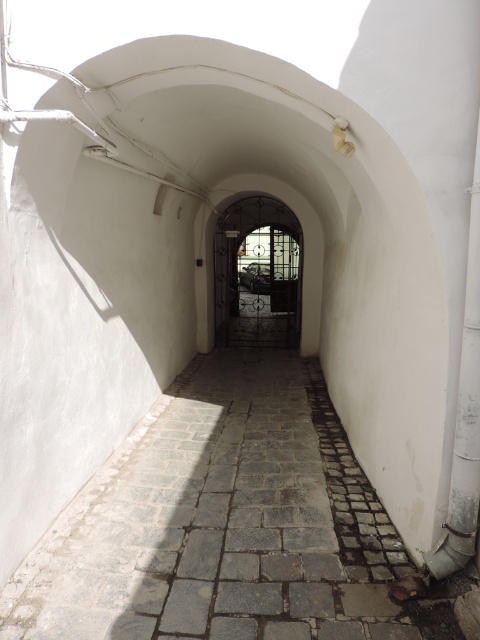
Based on the photo, you are a delivery person carrying a large package that is 2 meters wide. You need to navigate through the narrow arched passageway shown in the image. Can you pass through the space between the gray stone path at center and the dark wrought iron gate at center without tilting the package?

The gray stone path at center and dark wrought iron gate at center are 7.52 meters apart from each other. Since the package is only 2 meters wide, there is sufficient space between them to pass through without tilting the package.

You are a delivery person trying to push a large cart through the narrow arched passageway. The cart is as wide as the gray stone path at center. Can you pass through the dark wrought iron gate at center without any adjustments?

The gray stone path at center is bigger than the dark wrought iron gate at center. Since the cart is as wide as the path, it will not fit through the gate, which is narrower. Adjustments are needed to make the cart narrower or find an alternative route.

You are navigating through the arched passageway and need to determine the proximity of two points. Which point, point (136, 589) or point (285, 296), is nearer to you as you stand at the entrance?

Point (136, 589) is closer to the viewer than point (285, 296), so it is the nearer one.